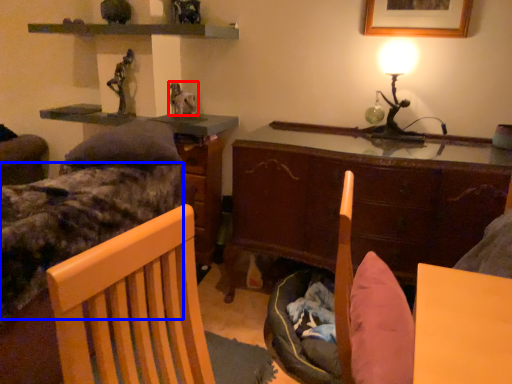
Question: Which object is closer to the camera taking this photo, animal (highlighted by a red box) or bed frame (highlighted by a blue box)?

Choices:
 (A) animal
 (B) bed frame

Answer: (B)